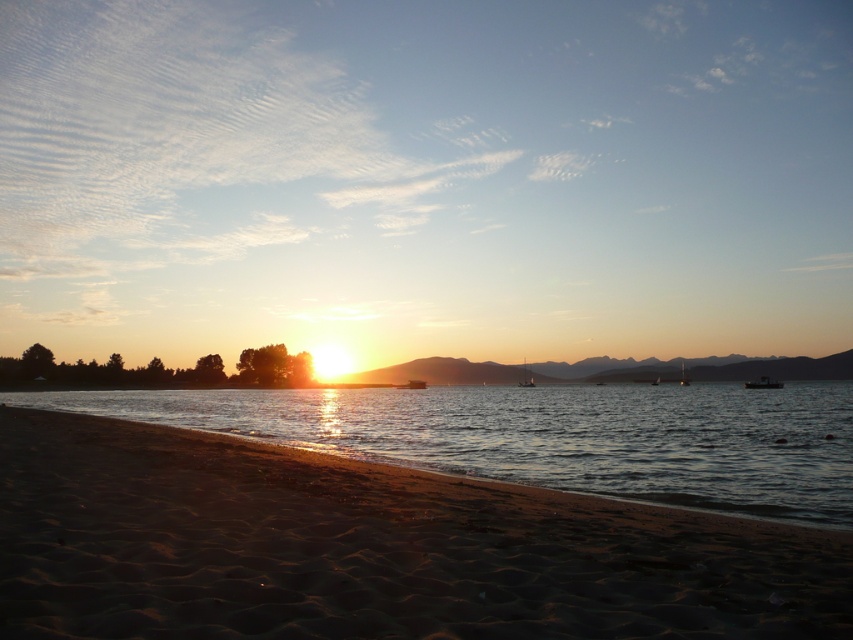
You are standing on the sandy beach at lower left and want to reach the glistening water at center. Which direction should you move to get there?

The sandy beach at lower left is positioned over the glistening water at center, so you should move downward towards the glistening water at center to reach it.

You are standing at the beach watching the sunset. You notice two points in the scene, one at coordinates point (328, 529) and another at point (236, 417). Which point is nearer to your eyes?

Point (328, 529) is closer to the camera than point (236, 417), so the point at coordinates point (328, 529) is nearer to your eyes.

You are standing at the point marked by the coordinates point (369,548) in the image. Which direction should you walk to reach the sandy beach at lower left?

The point (369,548) is already located on the sandy beach at lower left, so you are already there.